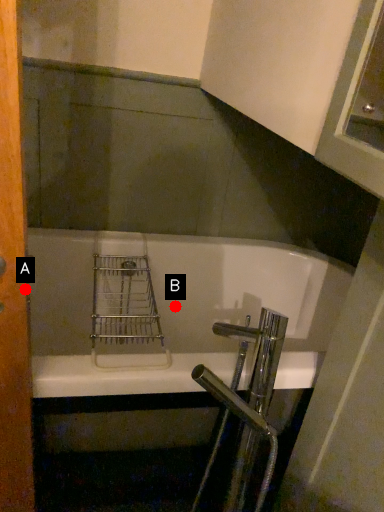
Question: Two points are circled on the image, labeled by A and B beside each circle. Which of the following is the farthest from the observer?

Choices:
 (A) A is further
 (B) B is further

Answer: (B)